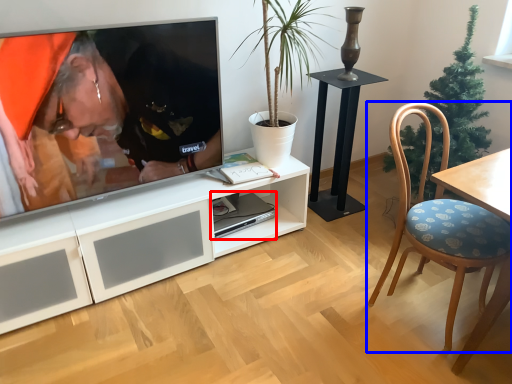
Question: Among these objects, which one is farthest to the camera, computer (highlighted by a red box) or chair (highlighted by a blue box)?

Choices:
 (A) computer
 (B) chair

Answer: (A)